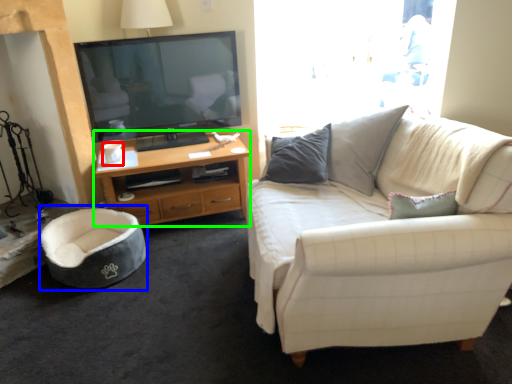
Question: Based on their relative distances, which object is nearer to coffee cup (highlighted by a red box)? Choose from bean bag chair (highlighted by a blue box) and desk (highlighted by a green box).

Choices:
 (A) bean bag chair
 (B) desk

Answer: (B)